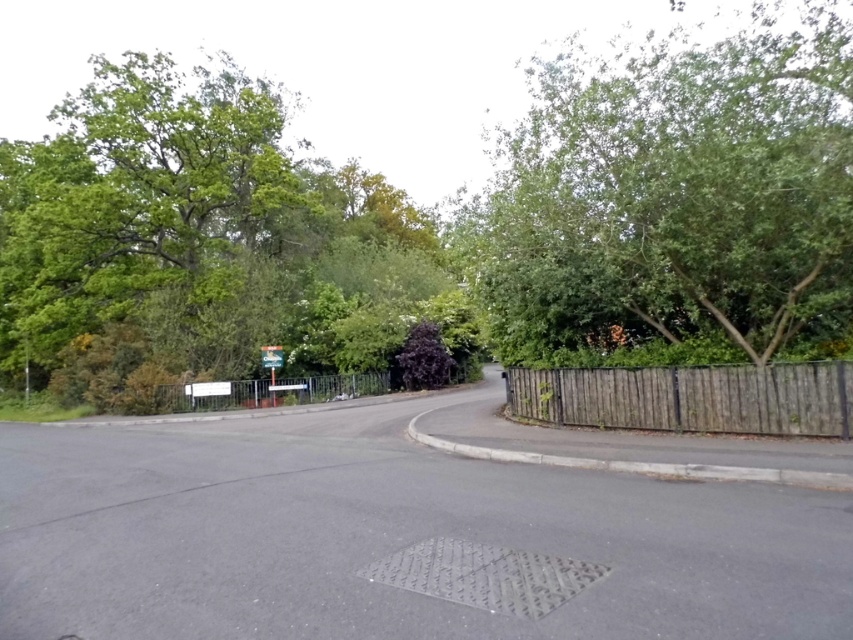
You are a delivery person trying to deliver a package to a house on this street corner. You see the metallic silver fence at center and the blue plastic sign at center. Which object is shorter?

The metallic silver fence at center is shorter than the blue plastic sign at center.

You are standing on the sidewalk next to the metallic silver fence at center and want to take a photo of the green leafy tree at upper left. Will the tree appear larger or smaller in your photo compared to the fence?

The green leafy tree at upper left is bigger than the metallic silver fence at center, so in the photo, the tree will appear larger than the fence.

You are a city planner reviewing this street layout. You need to determine if the green leafy tree at upper right and the blue plastic sign at center can be placed side by side without overlapping. Based on their widths, what do you conclude?

The green leafy tree at upper right is wider than the blue plastic sign at center. Since the tree is wider, placing them side by side would require more space, so they might overlap unless there is sufficient room. However, the exact spacing isn